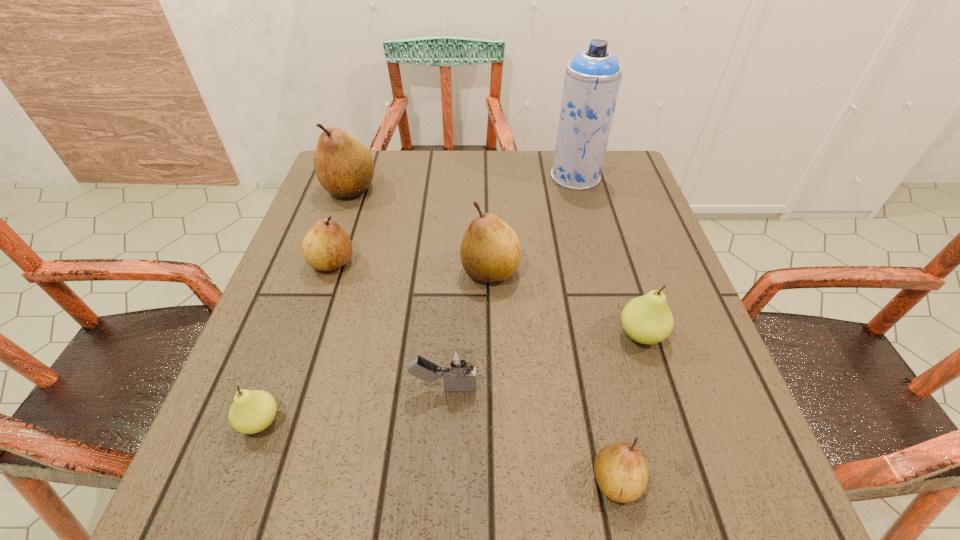
The image size is (960, 540). In order to click on aerosol can in this screenshot , I will do `click(593, 77)`.

In order to click on blue aerosol can in this screenshot , I will do click(593, 77).

The image size is (960, 540). I want to click on the biggest brown pear, so click(x=344, y=167).

Where is `the seventh shortest object`? the seventh shortest object is located at coordinates (344, 167).

The width and height of the screenshot is (960, 540). What are the coordinates of `the sixth shortest object` in the screenshot? It's located at (490, 251).

Locate an element on the screen. This screenshot has width=960, height=540. the fourth pear from left to right is located at coordinates (490, 251).

At what (x,y) coordinates should I click in order to perform the action: click on the third biggest brown pear. Please return your answer as a coordinate pair (x, y). Looking at the image, I should click on (326, 247).

Where is `the farther green pear`? The height and width of the screenshot is (540, 960). the farther green pear is located at coordinates (647, 319).

Find the location of `the rightmost pear`. the rightmost pear is located at coordinates (647, 319).

Image resolution: width=960 pixels, height=540 pixels. I want to click on gray igniter, so click(x=458, y=366).